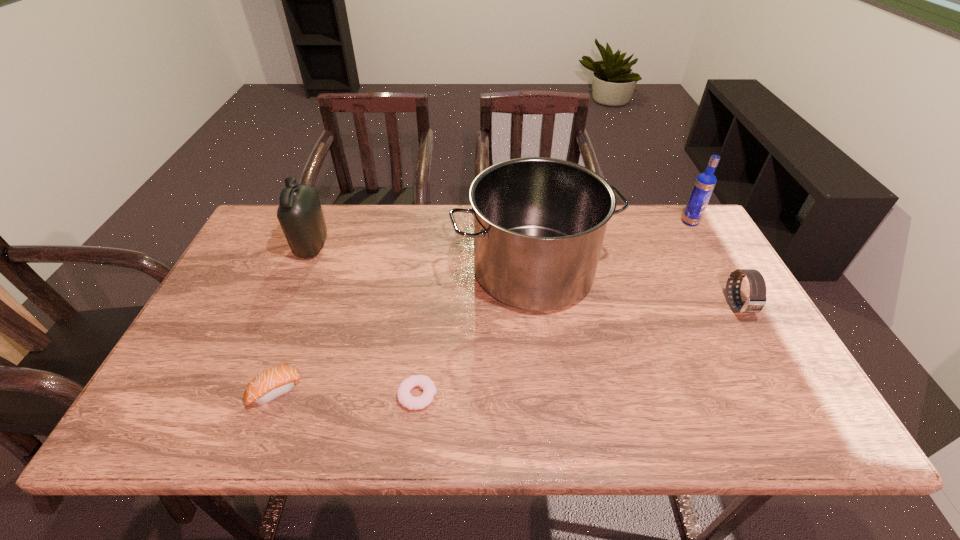
Where is `free area in between the farthest object and the fifth tallest object`? free area in between the farthest object and the fifth tallest object is located at coordinates tap(483, 307).

You are a GUI agent. You are given a task and a screenshot of the screen. Output one action in this format:
    pyautogui.click(x=<x>, y=<y>)
    Task: Click on the free space between the saucepan and the bottle
    
    Given the screenshot: What is the action you would take?
    pyautogui.click(x=422, y=259)

You are a GUI agent. You are given a task and a screenshot of the screen. Output one action in this format:
    pyautogui.click(x=<x>, y=<y>)
    Task: Click on the empty space between the sushi and the vodka
    Image resolution: width=960 pixels, height=540 pixels.
    Given the screenshot: What is the action you would take?
    pyautogui.click(x=483, y=307)

Find the location of a particular element. vacant area between the farthest object and the sushi is located at coordinates (483, 307).

Identify the location of vacant region between the bottle and the second shortest object. (294, 319).

At what (x,y) coordinates should I click in order to perform the action: click on unoccupied position between the farthest object and the fourth object from left to right. Please return your answer as a coordinate pair (x, y). This screenshot has width=960, height=540. Looking at the image, I should click on (612, 247).

The width and height of the screenshot is (960, 540). Find the location of `vacant area that lies between the fifth tallest object and the fourth object from right to left`. vacant area that lies between the fifth tallest object and the fourth object from right to left is located at coordinates (347, 393).

Identify the location of object identified as the closest to the watch. pos(539,223).

In order to click on the closest object relative to the fourth object from left to right in this screenshot , I will do `click(405, 398)`.

Find the location of a particular element. Image resolution: width=960 pixels, height=540 pixels. blank area in the image that satisfies the following two spatial constraints: 1. on the back side of the farthest object; 2. on the right side of the bottle is located at coordinates (323, 222).